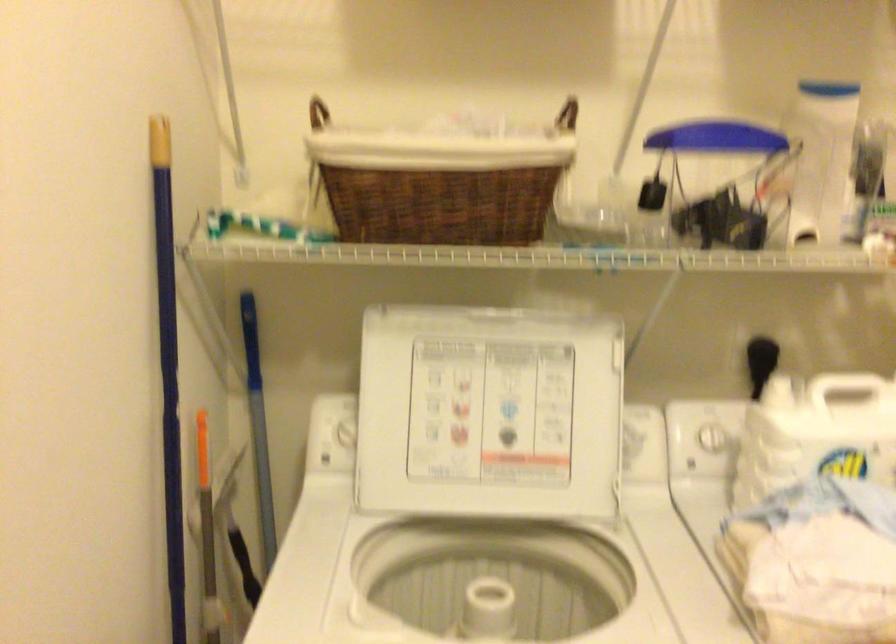
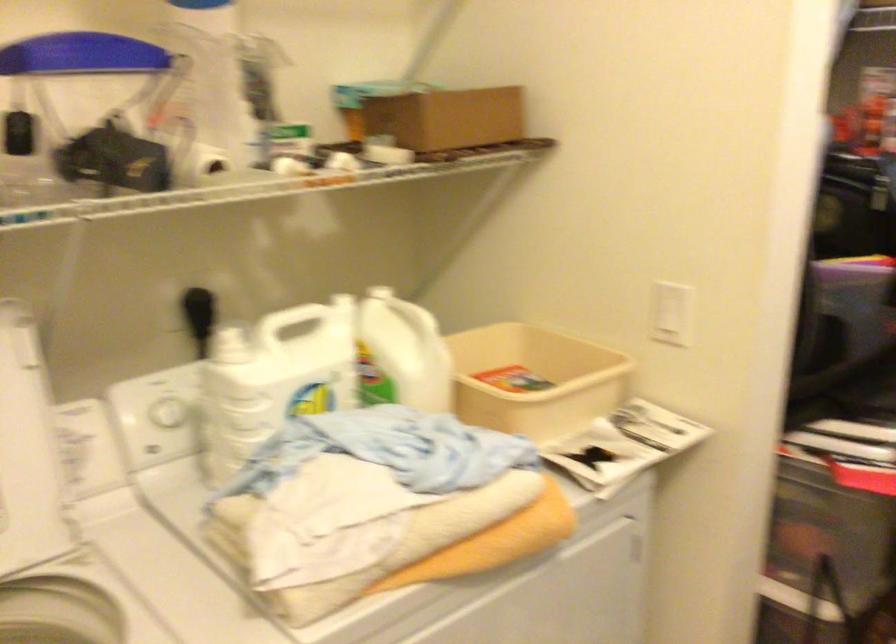
Where in the second image is the point corresponding to pixel 814 438 from the first image?

(273, 379)